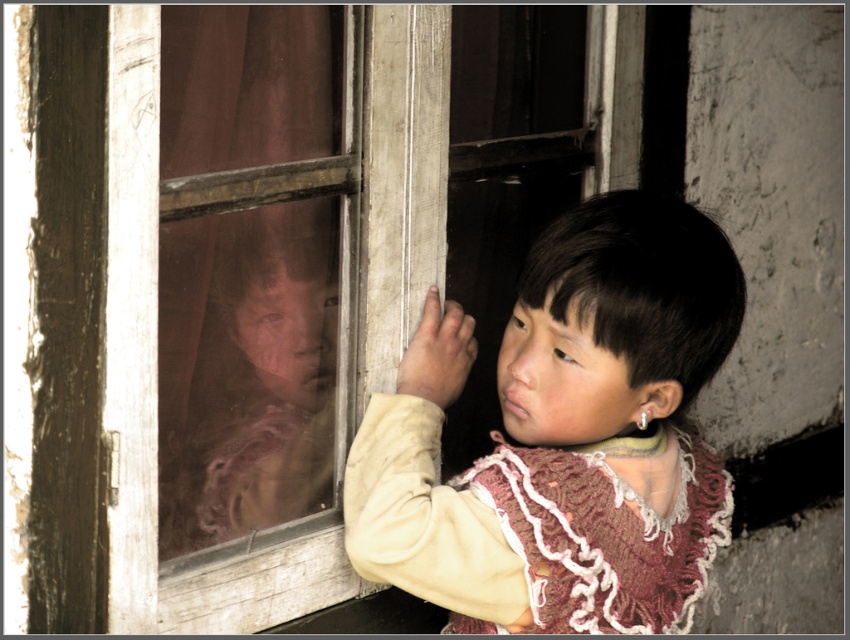
Based on the photo, you are a photographer trying to capture a closeup of the wooden frame at center and the light beige sweater at center. Since you can only focus on one object at a time, which object should you choose to ensure the other remains in the background without being too blurry?

The wooden frame at center is larger in size than the light beige sweater at center, so focusing on the wooden frame at center would keep the smaller light beige sweater at center in the background with less blur.

You are a tailor measuring fabrics for a project. You have a light beige sweater at center and a brown fabric curtain at left in front of you. Which fabric piece is wider?

The light beige sweater at center is wider than the brown fabric curtain at left according to the description.

Consider the image. You are standing in the scene and want to place a small sticker on the window. You have two options for placement based on coordinates given in the image. Which coordinate point, point (450, 504) or point (262, 332), would be closer to you?

Point (450, 504) is in front of point (262, 332), so placing the sticker at point (450, 504) would be closer to you.